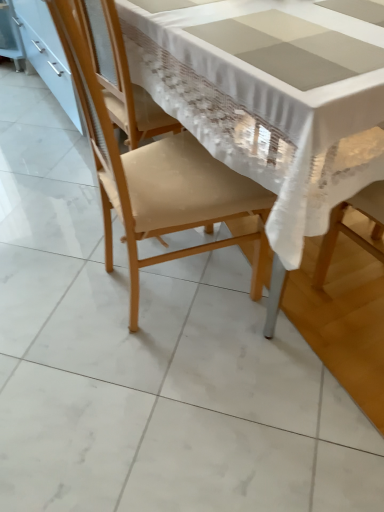
The height and width of the screenshot is (512, 384). I want to click on matte beige chair at center, so click(x=158, y=178).

In order to face matte beige chair at center, should I rotate leftwards or rightwards?

Turn left approximately 3.746 degrees to face it.

Locate an element on the screen. The image size is (384, 512). white lace tablecloth at center is located at coordinates (270, 97).

Where is `white glossy cabinet at left`? Image resolution: width=384 pixels, height=512 pixels. white glossy cabinet at left is located at coordinates (47, 54).

From the image's perspective, is white lace tablecloth at center above or below white glossy cabinet at left?

Clearly, from the image's perspective, white lace tablecloth at center is below white glossy cabinet at left.

Which is in front, point (220, 96) or point (18, 4)?

The point (220, 96) is in front.

Is white lace tablecloth at center further to the viewer compared to white glossy cabinet at left?

No, the depth of white lace tablecloth at center is less than that of white glossy cabinet at left.

Which of these two, white lace tablecloth at center or white glossy cabinet at left, is smaller?

white glossy cabinet at left.

Could you tell me if matte beige chair at center is turned towards white glossy cabinet at left?

No.

Which of these two, matte beige chair at center or white glossy cabinet at left, is thinner?

white glossy cabinet at left is thinner.

From the image's perspective, relative to white glossy cabinet at left, is matte beige chair at center above or below?

From the image's perspective, matte beige chair at center appears below white glossy cabinet at left.

Is point (52, 77) closer to viewer compared to point (192, 31)?

No, (52, 77) is further to viewer.

Image resolution: width=384 pixels, height=512 pixels. What are the coordinates of `table to the right of white glossy cabinet at left` in the screenshot? It's located at (270, 97).

Which of these two, white glossy cabinet at left or white lace tablecloth at center, is smaller?

Smaller between the two is white glossy cabinet at left.

In terms of height, does matte beige chair at center look taller or shorter compared to white lace tablecloth at center?

Clearly, matte beige chair at center is taller compared to white lace tablecloth at center.

Can you confirm if matte beige chair at center is positioned to the right of white lace tablecloth at center?

No, matte beige chair at center is not to the right of white lace tablecloth at center.

Is matte beige chair at center closer to camera compared to white lace tablecloth at center?

No.

How far apart are white glossy cabinet at left and matte beige chair at center?

The distance of white glossy cabinet at left from matte beige chair at center is 1.06 meters.

Can matte beige chair at center be found inside white glossy cabinet at left?

No, matte beige chair at center is not a part of white glossy cabinet at left.

Considering the sizes of objects white glossy cabinet at left and matte beige chair at center in the image provided, who is bigger, white glossy cabinet at left or matte beige chair at center?

white glossy cabinet at left.

Which point is more forward, (47, 47) or (194, 212)?

Point (194, 212)

Which is in front, white lace tablecloth at center or matte beige chair at center?

white lace tablecloth at center.

Considering the relative positions of white lace tablecloth at center and matte beige chair at center in the image provided, is white lace tablecloth at center to the left of matte beige chair at center from the viewer's perspective?

No.

From the image's perspective, is white lace tablecloth at center on top of matte beige chair at center?

Correct, white lace tablecloth at center appears higher than matte beige chair at center in the image.

Locate an element on the screen. The width and height of the screenshot is (384, 512). table lying in front of the white glossy cabinet at left is located at coordinates (270, 97).

In order to click on chair located above the white glossy cabinet at left (from a real-world perspective) in this screenshot , I will do `click(158, 178)`.

Considering their positions, is matte beige chair at center positioned closer to white glossy cabinet at left than white lace tablecloth at center?

matte beige chair at center lies closer to white glossy cabinet at left than the other object.

Based on the photo, estimate the real-world distances between objects in this image. Which object is further from white lace tablecloth at center, matte beige chair at center or white glossy cabinet at left?

Based on the image, white glossy cabinet at left appears to be further to white lace tablecloth at center.

When comparing their distances from white lace tablecloth at center, does white glossy cabinet at left or matte beige chair at center seem closer?

Among the two, matte beige chair at center is located nearer to white lace tablecloth at center.

Looking at the image, which one is located closer to white glossy cabinet at left, white lace tablecloth at center or matte beige chair at center?

Based on the image, matte beige chair at center appears to be nearer to white glossy cabinet at left.

From the image, which object appears to be farther from matte beige chair at center, white glossy cabinet at left or white lace tablecloth at center?

Among the two, white glossy cabinet at left is located further to matte beige chair at center.

Looking at the image, which one is located further to matte beige chair at center, white lace tablecloth at center or white glossy cabinet at left?

white glossy cabinet at left.

Find the location of a particular element. The height and width of the screenshot is (512, 384). chair positioned between white lace tablecloth at center and white glossy cabinet at left from near to far is located at coordinates (158, 178).